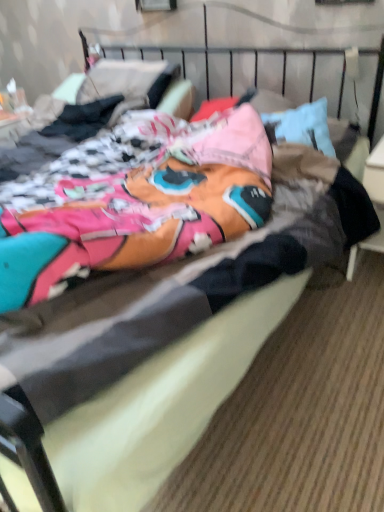
Measure the distance between point (366,183) and camera.

Point (366,183) is 1.81 meters away from camera.

Where is `white glossy table at right`? white glossy table at right is located at coordinates (375, 203).

What do you see at coordinates (375, 203) in the screenshot? I see `white glossy table at right` at bounding box center [375, 203].

Where is `white glossy table at right`? This screenshot has width=384, height=512. white glossy table at right is located at coordinates (375, 203).